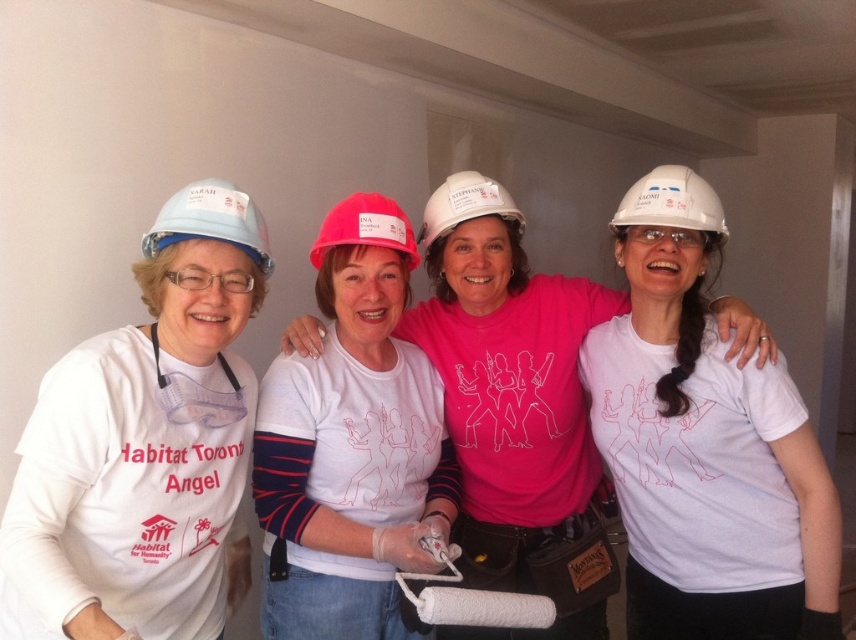
Question: Does matte white hard hat at left have a larger size compared to white hard hat at upper right?

Choices:
 (A) yes
 (B) no

Answer: (A)

Question: Is matte white hard hat at left bigger than white matte t-shirt at center?

Choices:
 (A) yes
 (B) no

Answer: (B)

Question: Is matte white hard hat at left to the right of pink fabric shirt at center from the viewer's perspective?

Choices:
 (A) no
 (B) yes

Answer: (A)

Question: Which object is closer to the camera taking this photo?

Choices:
 (A) white hard hat at center
 (B) pink fabric shirt at center

Answer: (B)

Question: Estimate the real-world distances between objects in this image. Which object is farther from the white matte t-shirt at center?

Choices:
 (A) matte white hard hat at left
 (B) white hard hat at center

Answer: (A)

Question: Which of the following is the farthest from the observer?

Choices:
 (A) matte white hard hat at left
 (B) white hard hat at upper right
 (C) white matte t-shirt at center

Answer: (B)